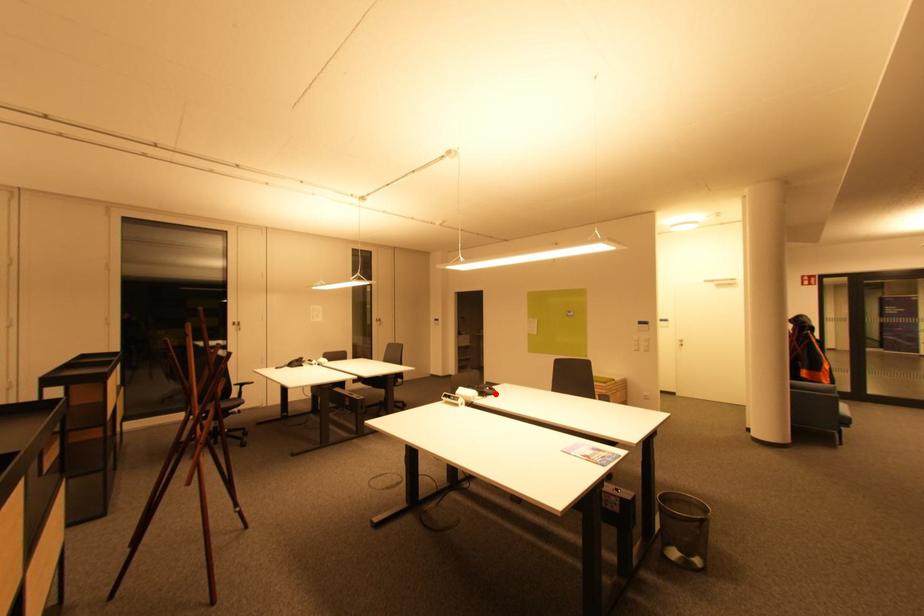
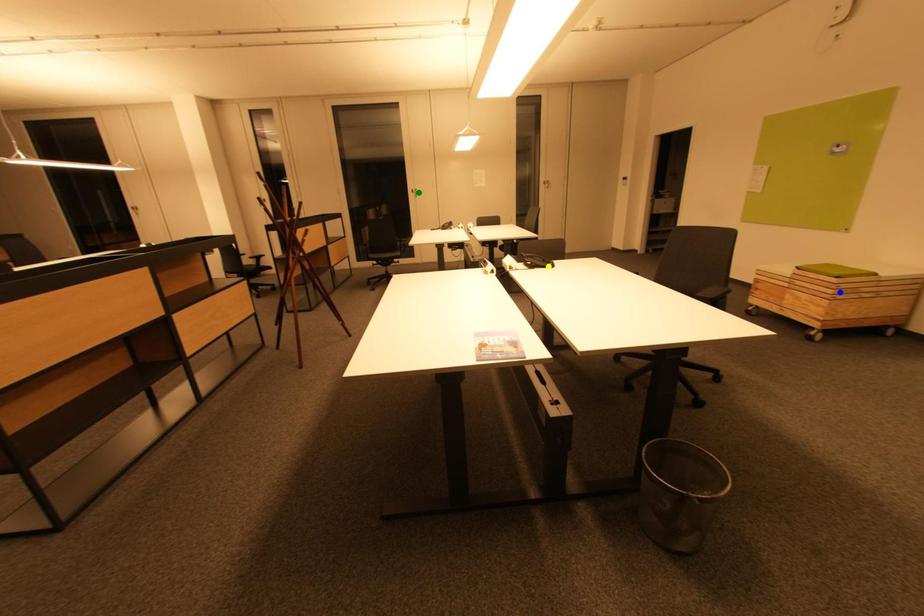
Question: I am providing you with two images of the same scene from different viewpoints. A red point is marked on the first image. You are given multiple points on the second image. Which mark in image 2 goes with the point in image 1?

Choices:
 (A) yellow point
 (B) blue point
 (C) green point

Answer: (A)